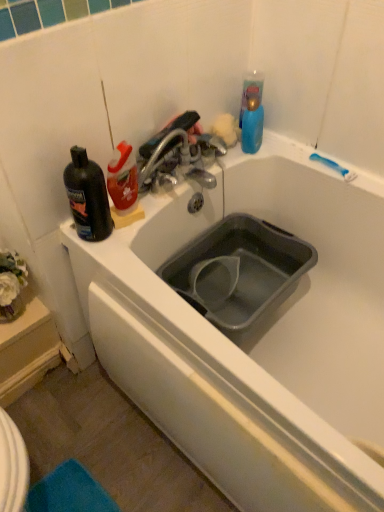
Question: Is white matte bathtub at center facing towards gray plastic sink at center?

Choices:
 (A) yes
 (B) no

Answer: (B)

Question: Does white matte bathtub at center have a lesser width compared to gray plastic sink at center?

Choices:
 (A) yes
 (B) no

Answer: (B)

Question: Does white matte bathtub at center have a smaller size compared to gray plastic sink at center?

Choices:
 (A) yes
 (B) no

Answer: (B)

Question: From a real-world perspective, is white matte bathtub at center beneath gray plastic sink at center?

Choices:
 (A) yes
 (B) no

Answer: (A)

Question: Would you say white matte bathtub at center is a long distance from gray plastic sink at center?

Choices:
 (A) yes
 (B) no

Answer: (B)

Question: Can you confirm if white matte bathtub at center is wider than gray plastic sink at center?

Choices:
 (A) yes
 (B) no

Answer: (A)

Question: Is metallic silver faucet at upper center taller than gray plastic sink at center?

Choices:
 (A) yes
 (B) no

Answer: (B)

Question: From the image's perspective, is metallic silver faucet at upper center above gray plastic sink at center?

Choices:
 (A) yes
 (B) no

Answer: (A)

Question: Is metallic silver faucet at upper center looking in the opposite direction of gray plastic sink at center?

Choices:
 (A) no
 (B) yes

Answer: (A)

Question: Is metallic silver faucet at upper center far from gray plastic sink at center?

Choices:
 (A) yes
 (B) no

Answer: (B)

Question: Is metallic silver faucet at upper center to the left of gray plastic sink at center from the viewer's perspective?

Choices:
 (A) no
 (B) yes

Answer: (B)

Question: From the image's perspective, is metallic silver faucet at upper center under gray plastic sink at center?

Choices:
 (A) no
 (B) yes

Answer: (A)

Question: Can you confirm if black plastic bottle at upper left is thinner than gray plastic sink at center?

Choices:
 (A) yes
 (B) no

Answer: (A)